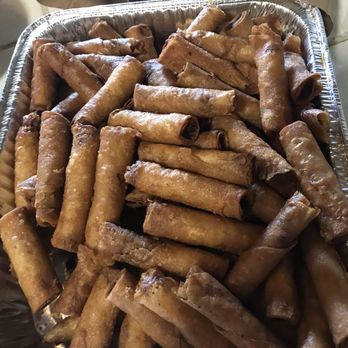
This screenshot has width=348, height=348. I want to click on metal pan, so click(x=68, y=37).